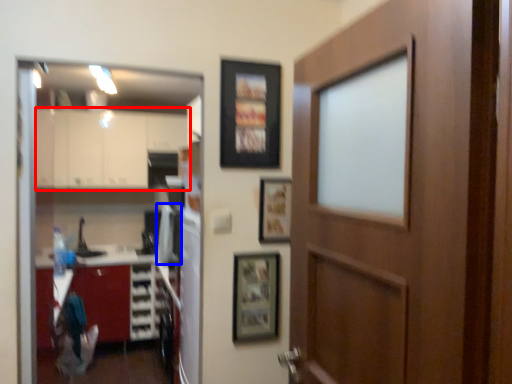
Question: Which of the following is the farthest to the observer, cabinetry (highlighted by a red box) or appliance (highlighted by a blue box)?

Choices:
 (A) cabinetry
 (B) appliance

Answer: (A)